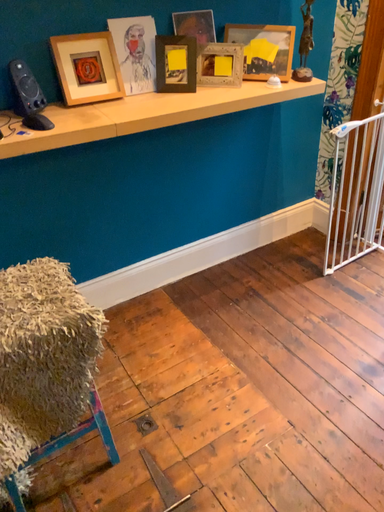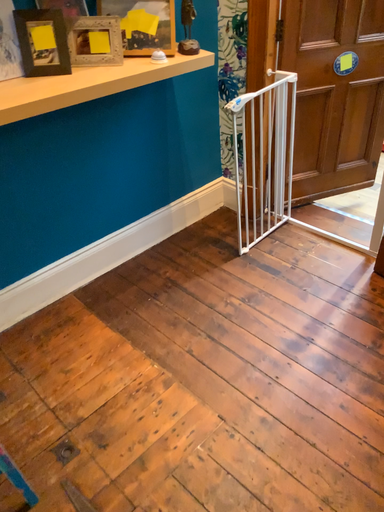
Question: Which way did the camera rotate in the video?

Choices:
 (A) rotated right
 (B) rotated left

Answer: (A)